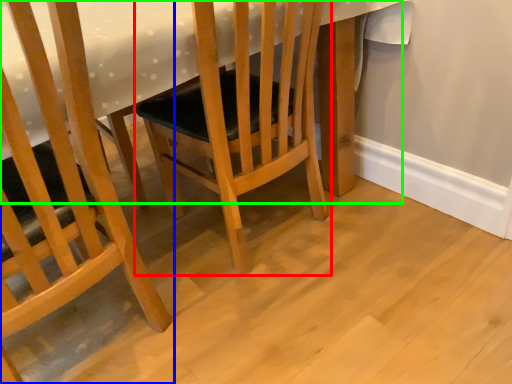
Question: Considering the real-world distances, which object is farthest from chair (highlighted by a red box)? chair (highlighted by a blue box) or table (highlighted by a green box)?

Choices:
 (A) chair
 (B) table

Answer: (A)